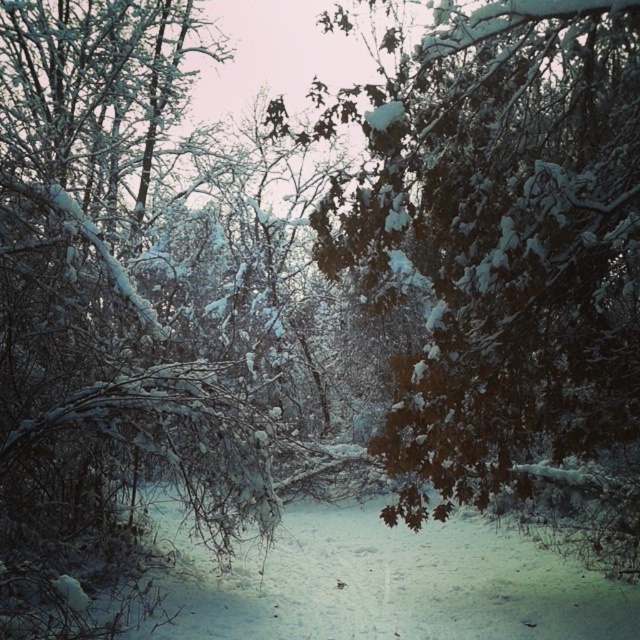
Which is above, snow-covered branches at center or white frosty branches at left?

snow-covered branches at center is above.

Consider the image. Who is taller, snow-covered branches at center or white frosty branches at left?

With more height is white frosty branches at left.

Measure the distance between snow-covered branches at center and camera.

The distance of snow-covered branches at center from camera is 8.69 meters.

At what (x,y) coordinates should I click in order to perform the action: click on snow-covered branches at center. Please return your answer as a coordinate pair (x, y). The width and height of the screenshot is (640, 640). Looking at the image, I should click on click(508, 260).